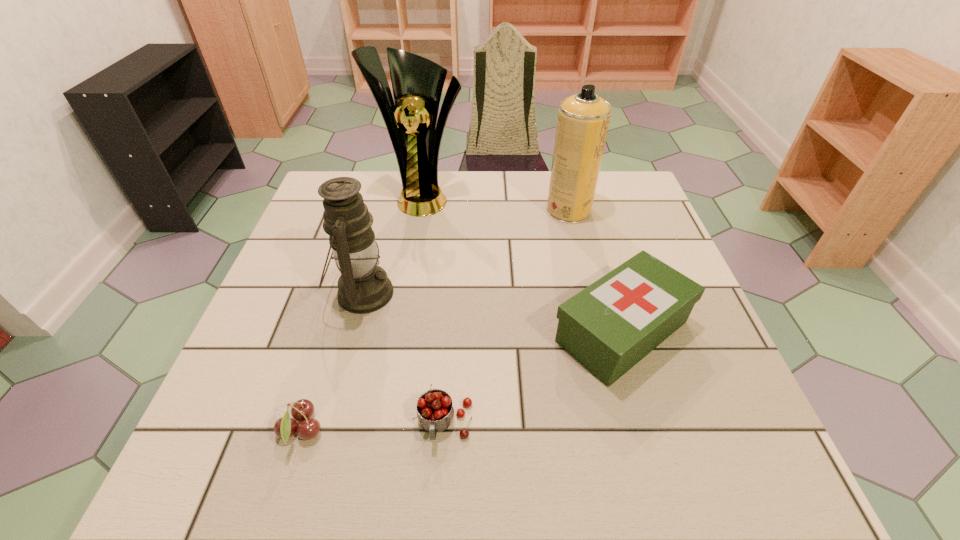
Find the location of a particular element. This screenshot has width=960, height=540. award is located at coordinates (417, 82).

The image size is (960, 540). In order to click on aerosol can in this screenshot , I will do `click(583, 119)`.

This screenshot has height=540, width=960. In order to click on the third tallest object in this screenshot , I will do `click(363, 287)`.

At what (x,y) coordinates should I click in order to perform the action: click on the first-aid kit. Please return your answer as a coordinate pair (x, y). Image resolution: width=960 pixels, height=540 pixels. Looking at the image, I should click on (611, 325).

The width and height of the screenshot is (960, 540). Find the location of `the taller cherry`. the taller cherry is located at coordinates (435, 412).

Find the location of a particular element. The width and height of the screenshot is (960, 540). the shortest object is located at coordinates (285, 427).

Locate an element on the screen. the left cherry is located at coordinates (285, 427).

Locate an element on the screen. free region located at the front of the award, where the globe is visible is located at coordinates (413, 255).

Where is `vacant space located 0.090m on the front of the aerosol can`? The width and height of the screenshot is (960, 540). vacant space located 0.090m on the front of the aerosol can is located at coordinates (577, 246).

Find the location of `vacant space located 0.090m on the right of the fourth shortest object`. vacant space located 0.090m on the right of the fourth shortest object is located at coordinates (433, 293).